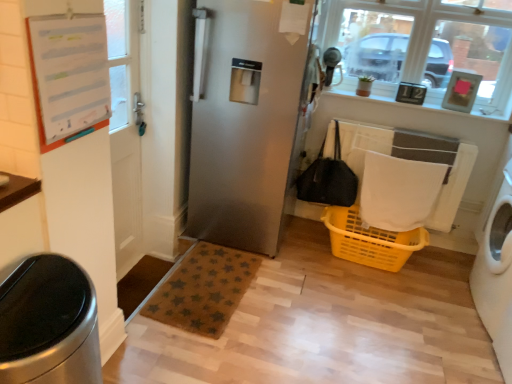
At what (x,y) coordinates should I click in order to perform the action: click on free spot above brown textured mat at lower center (from a real-world perspective). Please return your answer as a coordinate pair (x, y). Image resolution: width=512 pixels, height=384 pixels. Looking at the image, I should click on (195, 281).